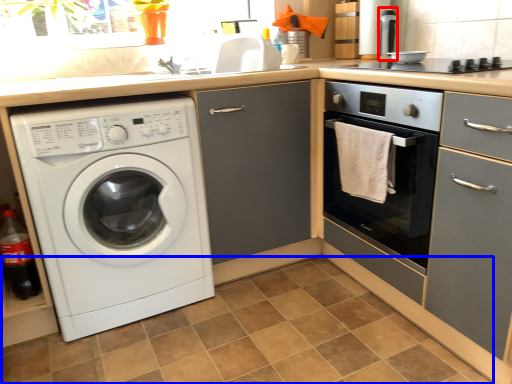
Question: Which object is closer to the camera taking this photo, appliance (highlighted by a red box) or tile (highlighted by a blue box)?

Choices:
 (A) appliance
 (B) tile

Answer: (B)